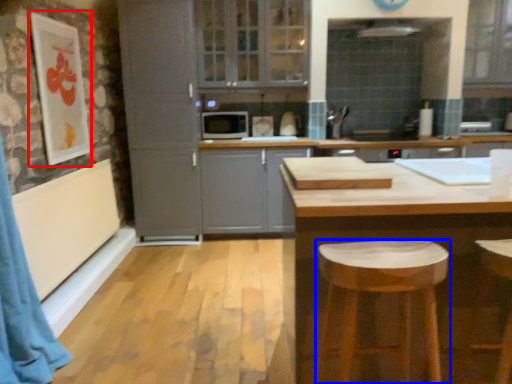
Question: Which of the following is the farthest to the observer, picture frame (highlighted by a red box) or stool (highlighted by a blue box)?

Choices:
 (A) picture frame
 (B) stool

Answer: (A)